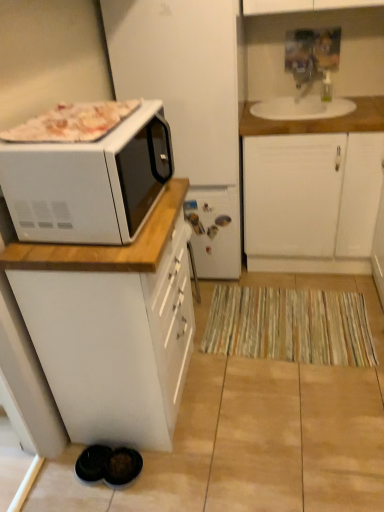
Find the location of a particular element. The width and height of the screenshot is (384, 512). vacant area on top of striped fabric mat at lower center (from a real-world perspective) is located at coordinates (286, 315).